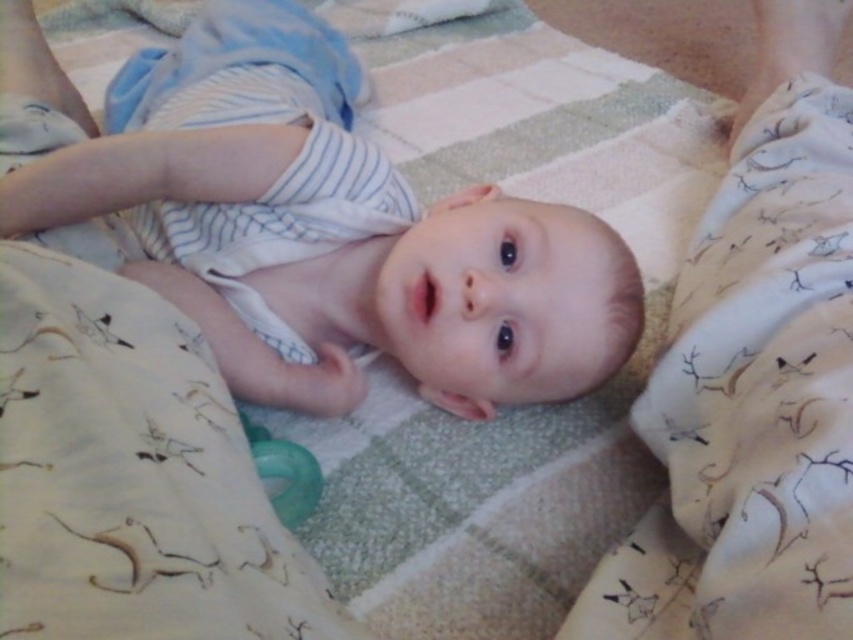
Question: Does beige cotton blanket at lower right have a larger size compared to light beige cotton blanket at center?

Choices:
 (A) yes
 (B) no

Answer: (A)

Question: Does light beige cotton blanket at center have a greater width compared to green rubber pacifier at center?

Choices:
 (A) yes
 (B) no

Answer: (A)

Question: Which object is the closest to the green rubber pacifier at center?

Choices:
 (A) beige cotton blanket at lower right
 (B) light beige cotton blanket at center

Answer: (B)

Question: Which point is farther to the camera?

Choices:
 (A) beige cotton blanket at lower right
 (B) white soft baby at center
 (C) green rubber pacifier at center

Answer: (B)

Question: Does beige cotton blanket at lower right have a lesser width compared to green rubber pacifier at center?

Choices:
 (A) no
 (B) yes

Answer: (A)

Question: Which point is closer to the camera taking this photo?

Choices:
 (A) (392, 321)
 (B) (699, 522)
 (C) (271, 488)

Answer: (B)